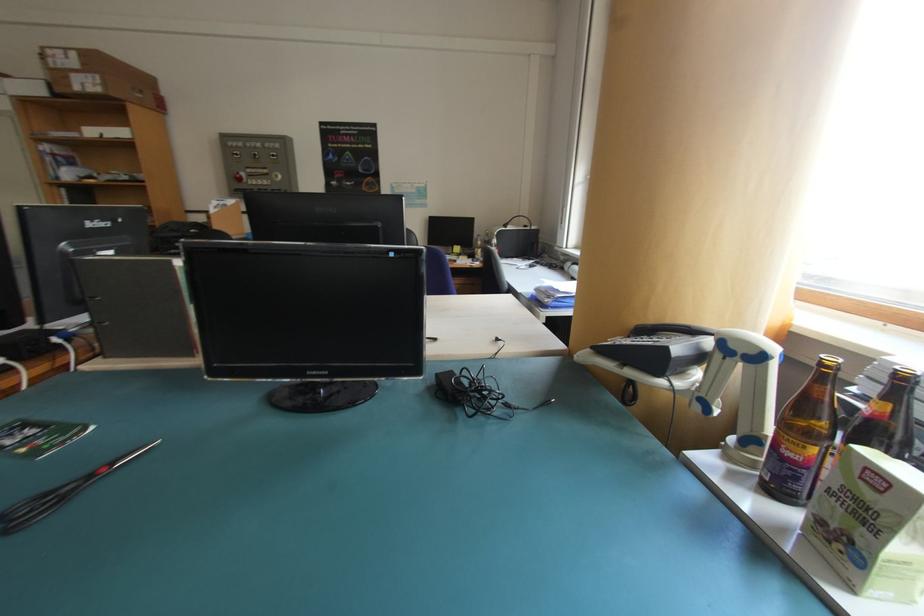
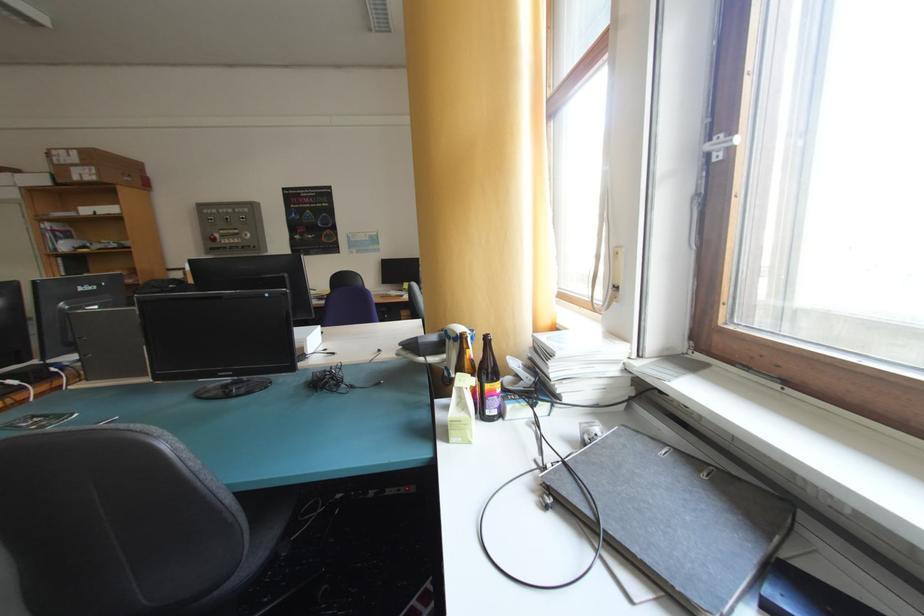
The point at (761,354) is marked in the first image. Where is the corresponding point in the second image?

(464, 337)